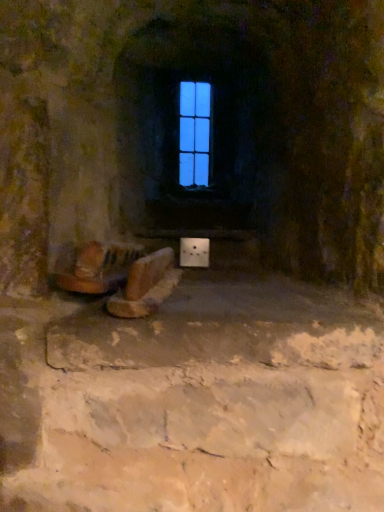
The height and width of the screenshot is (512, 384). What do you see at coordinates (124, 277) in the screenshot?
I see `wooden stool at lower center` at bounding box center [124, 277].

The image size is (384, 512). What are the coordinates of `wooden stool at lower center` in the screenshot? It's located at (124, 277).

What is the approximate width of blue glass window at center?

blue glass window at center is 1.17 inches in width.

Image resolution: width=384 pixels, height=512 pixels. Describe the element at coordinates (194, 133) in the screenshot. I see `blue glass window at center` at that location.

This screenshot has width=384, height=512. In order to click on blue glass window at center in this screenshot , I will do `click(194, 133)`.

In order to face blue glass window at center, should I rotate leftwards or rightwards?

Turn right by 0.268 degrees to look at blue glass window at center.

Locate an element on the screen. The width and height of the screenshot is (384, 512). wooden stool at lower center is located at coordinates (124, 277).

Considering the positions of objects wooden stool at lower center and blue glass window at center in the image provided, who is more to the left, wooden stool at lower center or blue glass window at center?

Positioned to the left is wooden stool at lower center.

Who is more distant, wooden stool at lower center or blue glass window at center?

blue glass window at center is further from the camera.

Considering the points (148, 283) and (191, 183), which point is behind, point (148, 283) or point (191, 183)?

The point (191, 183) is behind.

From the image's perspective, which one is positioned lower, wooden stool at lower center or blue glass window at center?

wooden stool at lower center, from the image's perspective.

From a real-world perspective, is wooden stool at lower center below blue glass window at center?

Yes.

Looking at their sizes, would you say wooden stool at lower center is wider or thinner than blue glass window at center?

Clearly, wooden stool at lower center has more width compared to blue glass window at center.

In terms of height, does wooden stool at lower center look taller or shorter compared to blue glass window at center?

Clearly, wooden stool at lower center is shorter compared to blue glass window at center.

Which of these two, wooden stool at lower center or blue glass window at center, is bigger?

wooden stool at lower center.

Is blue glass window at center completely or partially inside wooden stool at lower center?

No, blue glass window at center is located outside of wooden stool at lower center.

Is wooden stool at lower center directly adjacent to blue glass window at center?

No, wooden stool at lower center is not with blue glass window at center.

Is wooden stool at lower center turned away from blue glass window at center?

No.

How different are the orientations of wooden stool at lower center and blue glass window at center in degrees?

9.83 degrees.

Measure the distance between wooden stool at lower center and blue glass window at center.

The distance of wooden stool at lower center from blue glass window at center is 1.11 meters.

You are a GUI agent. You are given a task and a screenshot of the screen. Output one action in this format:
    pyautogui.click(x=<x>, y=<y>)
    Task: Click on the window on the right of the wooden stool at lower center
    The image size is (384, 512).
    Given the screenshot: What is the action you would take?
    pyautogui.click(x=194, y=133)

Is blue glass window at center at the left side of wooden stool at lower center?

Incorrect, blue glass window at center is not on the left side of wooden stool at lower center.

Is blue glass window at center positioned behind wooden stool at lower center?

Yes, it is behind wooden stool at lower center.

Which point is more forward, [196,178] or [130,264]?

The point [130,264] is closer to the camera.

From the image's perspective, is blue glass window at center positioned above or below wooden stool at lower center?

Based on their image positions, blue glass window at center is located above wooden stool at lower center.

From a real-world perspective, is blue glass window at center positioned over wooden stool at lower center based on gravity?

Yes.

Which object is wider, blue glass window at center or wooden stool at lower center?

With larger width is wooden stool at lower center.

Who is taller, blue glass window at center or wooden stool at lower center?

With more height is blue glass window at center.

In the scene shown: Considering the sizes of objects blue glass window at center and wooden stool at lower center in the image provided, who is smaller, blue glass window at center or wooden stool at lower center?

Smaller between the two is blue glass window at center.

Is blue glass window at center inside or outside of wooden stool at lower center?

blue glass window at center is not enclosed by wooden stool at lower center.

Based on the photo, would you say blue glass window at center is a long distance from wooden stool at lower center?

blue glass window at center is positioned a significant distance from wooden stool at lower center.

Is blue glass window at center oriented away from wooden stool at lower center?

No, blue glass window at center is not facing away from wooden stool at lower center.

Can you tell me how much blue glass window at center and wooden stool at lower center differ in facing direction?

blue glass window at center and wooden stool at lower center are facing 9.83 degrees away from each other.

The height and width of the screenshot is (512, 384). I want to click on furniture that appears below the blue glass window at center (from the image's perspective), so click(124, 277).

Locate an element on the screen. window above the wooden stool at lower center (from a real-world perspective) is located at coordinates (194, 133).

Identify the location of window behind the wooden stool at lower center. The width and height of the screenshot is (384, 512). (194, 133).